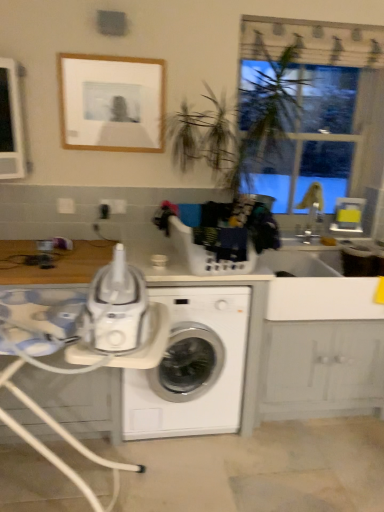
Question: Would you say white plastic tray at center is inside or outside white glossy washing machine at center?

Choices:
 (A) outside
 (B) inside

Answer: (B)

Question: Would you say white plastic tray at center is to the left or to the right of white glossy washing machine at center in the picture?

Choices:
 (A) left
 (B) right

Answer: (A)

Question: Which object is positioned closest to the transparent plastic window screen at upper right?

Choices:
 (A) white glossy washing machine at center
 (B) white plastic tray at center
 (C) white plastic table at lower left
 (D) wooden frame at upper center

Answer: (D)

Question: Based on their relative distances, which object is farther from the wooden frame at upper center?

Choices:
 (A) white glossy washing machine at center
 (B) white plastic tray at center
 (C) transparent plastic window screen at upper right
 (D) white plastic table at lower left

Answer: (D)